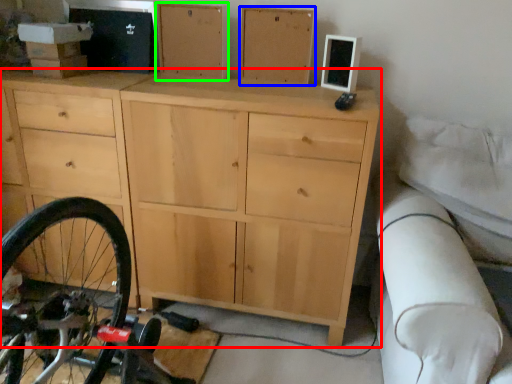
Question: Estimate the real-world distances between objects in this image. Which object is farther from chest of drawers (highlighted by a red box), chest of drawer (highlighted by a blue box) or chest of drawer (highlighted by a green box)?

Choices:
 (A) chest of drawer
 (B) chest of drawer

Answer: (A)